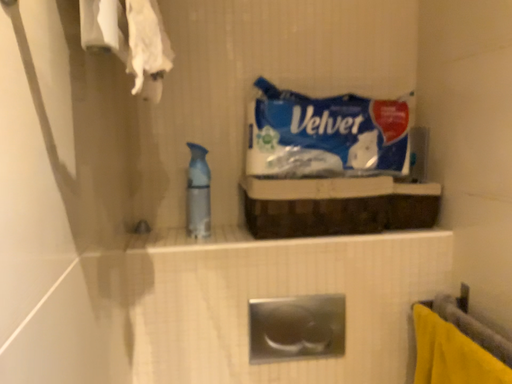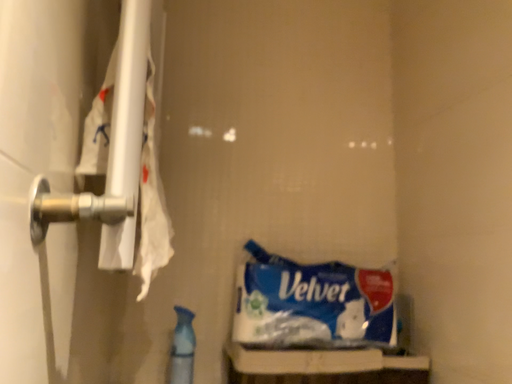
Question: Which way did the camera rotate in the video?

Choices:
 (A) rotated downward
 (B) rotated upward

Answer: (B)